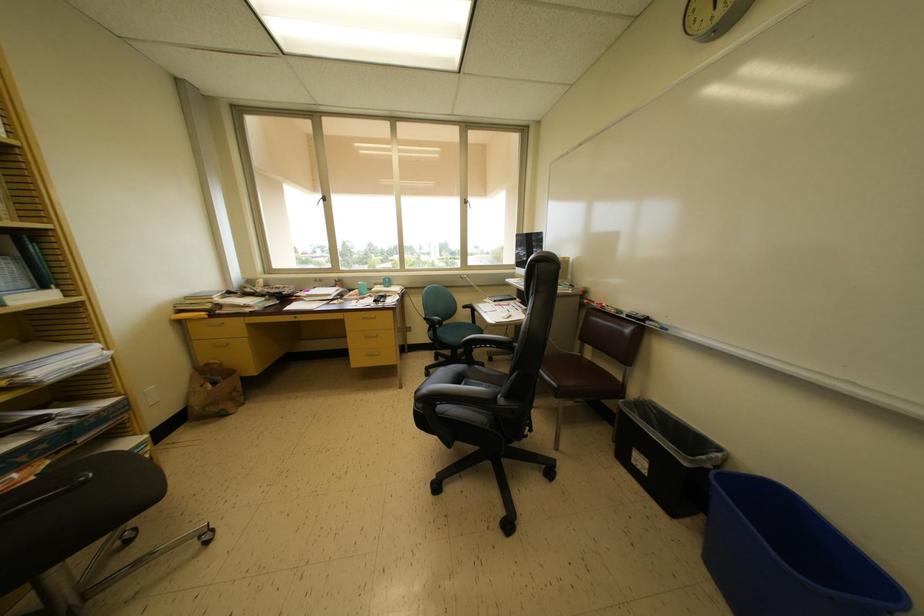
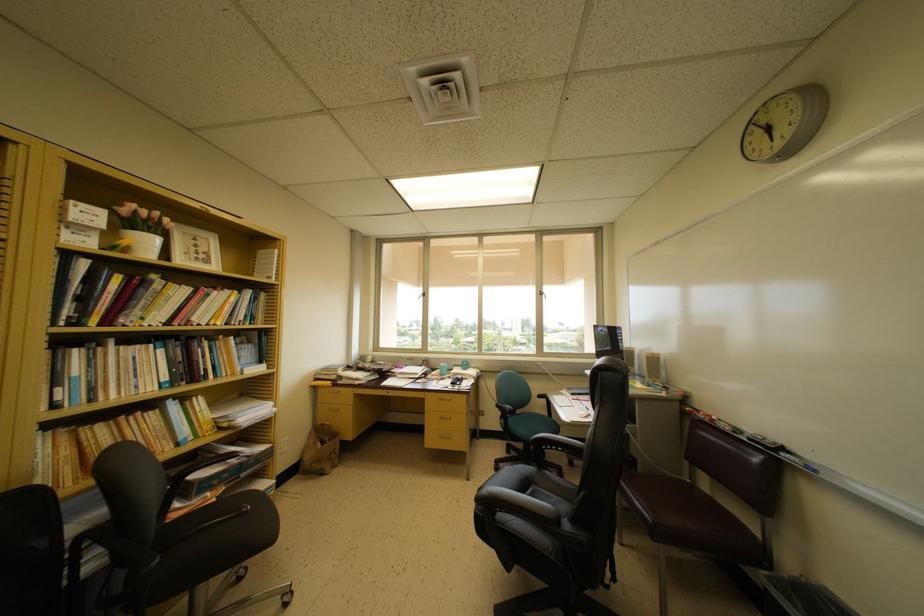
Where in the second image is the point corresponding to point (475, 326) from the first image?

(551, 419)